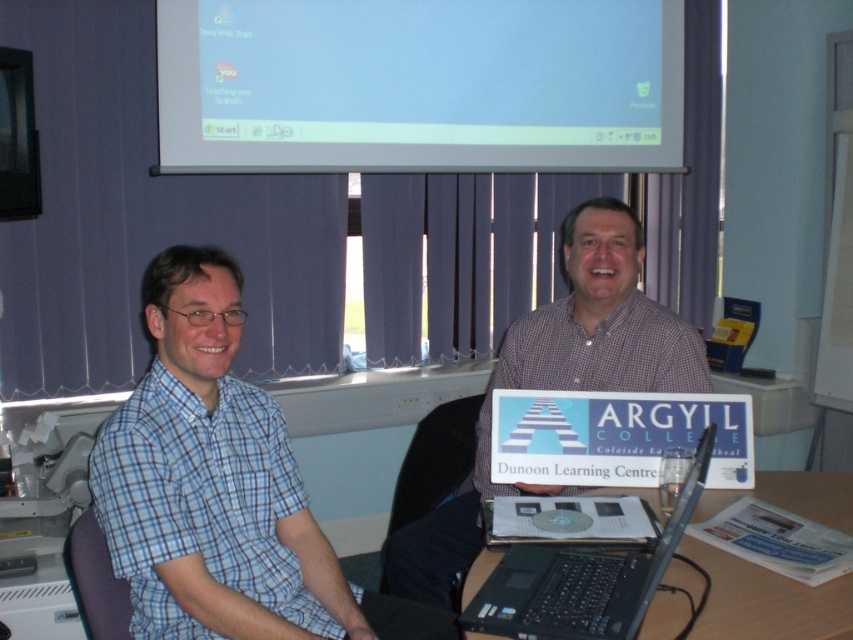
Can you confirm if white glossy screen at upper center is wider than blue checkered shirt at left?

Yes.

Between white glossy screen at upper center and blue checkered shirt at left, which one is positioned lower?

blue checkered shirt at left

Is point (271, 132) farther from viewer compared to point (250, 620)?

Yes, it is behind point (250, 620).

Where is `white glossy screen at upper center`? white glossy screen at upper center is located at coordinates (419, 84).

Does point (369, 612) come in front of point (650, 301)?

Yes, point (369, 612) is closer to viewer.

Does blue checkered shirt at left have a lesser width compared to checkered shirt at center?

Yes, blue checkered shirt at left is thinner than checkered shirt at center.

You are a GUI agent. You are given a task and a screenshot of the screen. Output one action in this format:
    pyautogui.click(x=<x>, y=<y>)
    Task: Click on the blue checkered shirt at left
    The width and height of the screenshot is (853, 640).
    Given the screenshot: What is the action you would take?
    pyautogui.click(x=219, y=488)

Who is more forward, (451, 536) or (532, 614)?

Point (532, 614) is in front.

This screenshot has width=853, height=640. Identify the location of checkered shirt at center. (556, 381).

This screenshot has height=640, width=853. Describe the element at coordinates (556, 381) in the screenshot. I see `checkered shirt at center` at that location.

Locate an element on the screen. The width and height of the screenshot is (853, 640). checkered shirt at center is located at coordinates (556, 381).